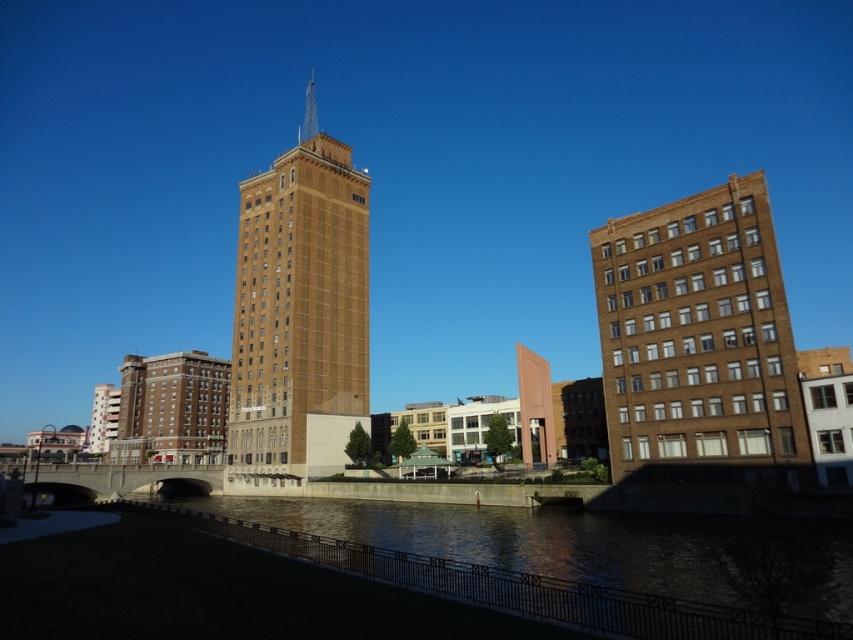
From the picture: You are a bird flying over the urban area and want to land on the highest point between the brown brick tower at center and the brown concrete river at lower center. Which one should you choose?

The brown brick tower at center is taller than the brown concrete river at lower center, so you should choose the brown brick tower at center to land on the highest point.

You are a delivery drone that needs to fly from the brown brick building at right to the brown concrete river at lower center. What is the minimum horizontal distance you must cover to reach the river from the building?

The minimum horizontal distance between the brown brick building at right and the brown concrete river at lower center is 27.34 meters, so the drone must cover at least 27.34 meters to reach the river from the building.

From the picture: You are an architect evaluating the urban layout. Based on the scene, which structure takes up more area in the image, the brown brick building at right or the brown brick tower at center?

The brown brick tower at center occupies more space than the brown brick building at right, so the tower takes up more area in the image.